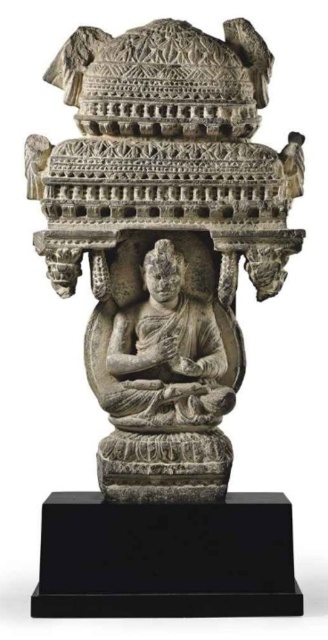
Consider the image. You are an art conservator examining the stone sculpture. You notice two objects labeled as the stone statue at center and the gray stone buddha at center. Which one is taller?

The stone statue at center is taller than the gray stone buddha at center according to the description provided.

You are an art conservator assessing the dimensions of the stone statue at center and the gray stone buddha at center. Which one has a greater width?

The stone statue at center has a greater width than the gray stone buddha at center according to the description.